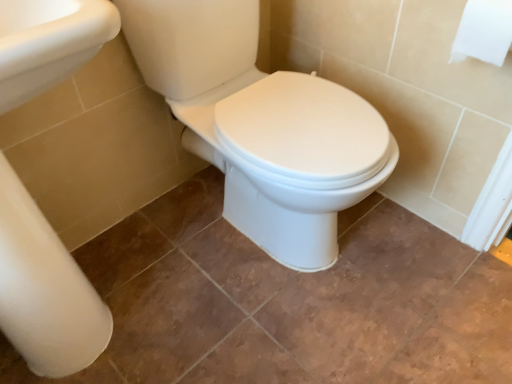
Where is `vacant space to the right of white glossy porcelain at center`? vacant space to the right of white glossy porcelain at center is located at coordinates (430, 272).